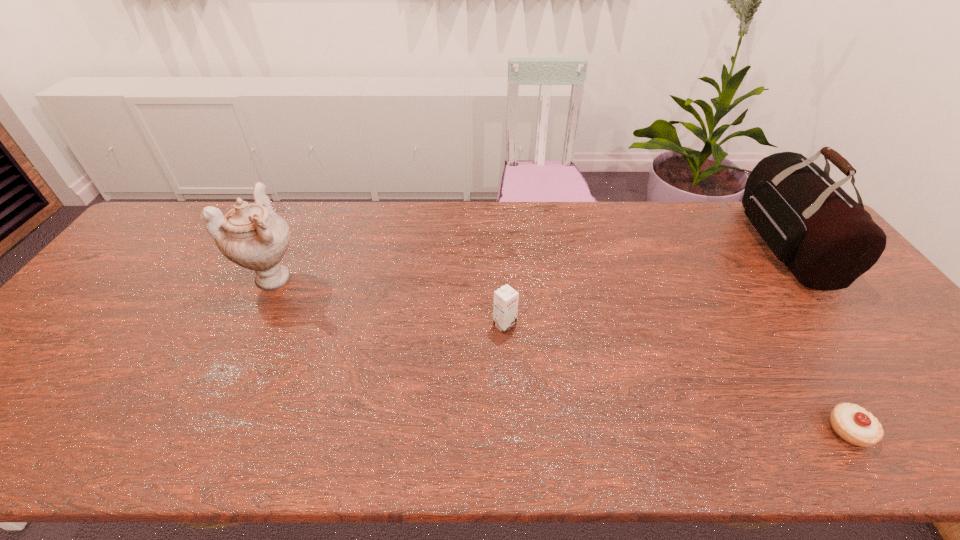
Find the location of a particular element. The width and height of the screenshot is (960, 540). vacant space located on the back of the chocolate milk is located at coordinates (503, 302).

Find the location of a particular element. vacant space located on the left of the pastry is located at coordinates (757, 430).

What are the coordinates of `object that is at the far edge` in the screenshot? It's located at (826, 239).

The width and height of the screenshot is (960, 540). In order to click on object that is positioned at the near edge in this screenshot , I will do `click(852, 423)`.

Where is `object that is at the right edge`? object that is at the right edge is located at coordinates (826, 239).

Find the location of a particular element. object at the far right corner is located at coordinates [x=826, y=239].

In the image, there is a desktop. Where is `vacant region at the far edge`? This screenshot has height=540, width=960. vacant region at the far edge is located at coordinates (398, 225).

The width and height of the screenshot is (960, 540). In the image, there is a desktop. Identify the location of vacant space at the near edge. (434, 438).

This screenshot has height=540, width=960. Find the location of `vacant space at the left edge of the desktop`. vacant space at the left edge of the desktop is located at coordinates (147, 288).

Find the location of a particular element. This screenshot has height=540, width=960. vacant space at the far left corner of the desktop is located at coordinates (175, 213).